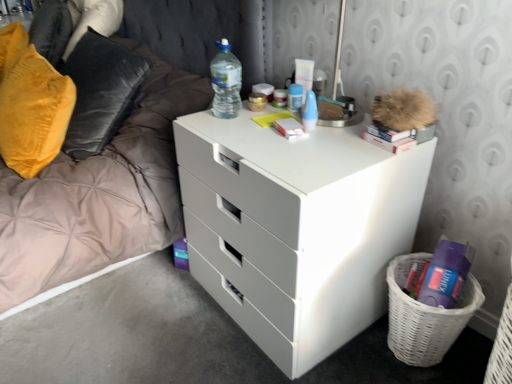
Where is `free location in front of white matte book at center, which ranks as the second book in right-to-left order`? free location in front of white matte book at center, which ranks as the second book in right-to-left order is located at coordinates (292, 155).